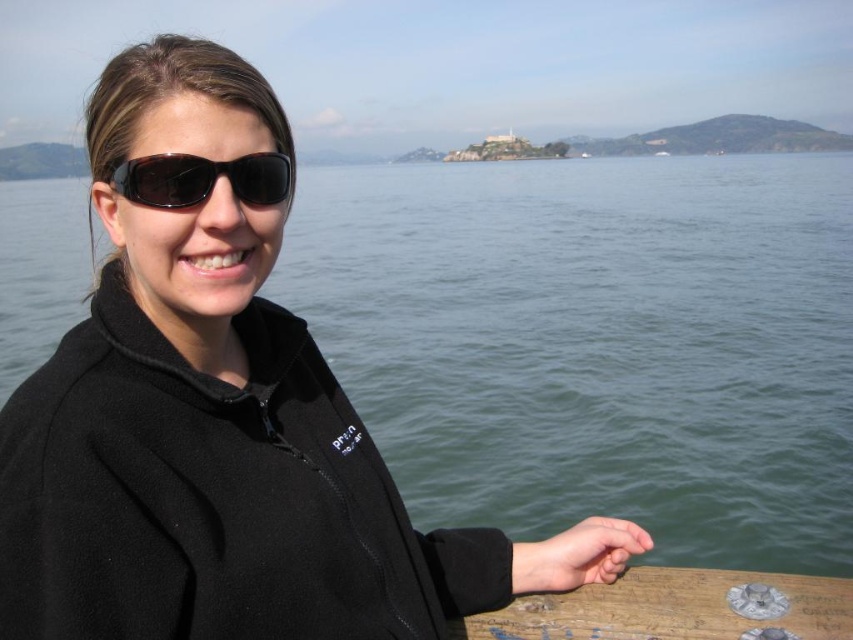
Question: Can you confirm if black plastic sunglasses at upper center is thinner than matte black hand at lower right?

Choices:
 (A) no
 (B) yes

Answer: (A)

Question: Which of the following is the closest to the observer?

Choices:
 (A) black plastic sunglasses at upper center
 (B) green water at center

Answer: (A)

Question: Does green water at center appear over black plastic sunglasses at upper center?

Choices:
 (A) no
 (B) yes

Answer: (B)

Question: Considering the relative positions of green water at center and black plastic sunglasses at upper center in the image provided, where is green water at center located with respect to black plastic sunglasses at upper center?

Choices:
 (A) left
 (B) right

Answer: (B)

Question: Which point is closer to the camera?

Choices:
 (A) matte black hand at lower right
 (B) black plastic sunglasses at upper center

Answer: (B)

Question: Among these points, which one is nearest to the camera?

Choices:
 (A) (718, 493)
 (B) (631, 540)
 (C) (224, 173)

Answer: (C)